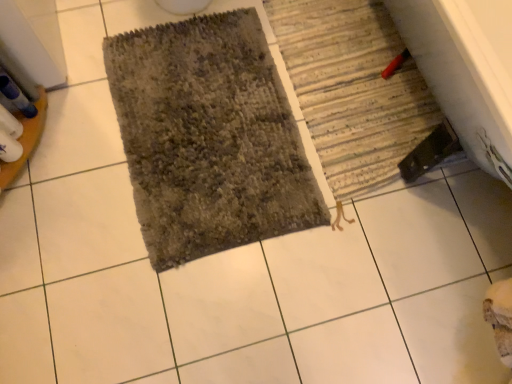
Identify the location of free spot above striped fabric bath mat at lower right, which is the first bath mat in right-to-left order (from a real-world perspective). (355, 78).